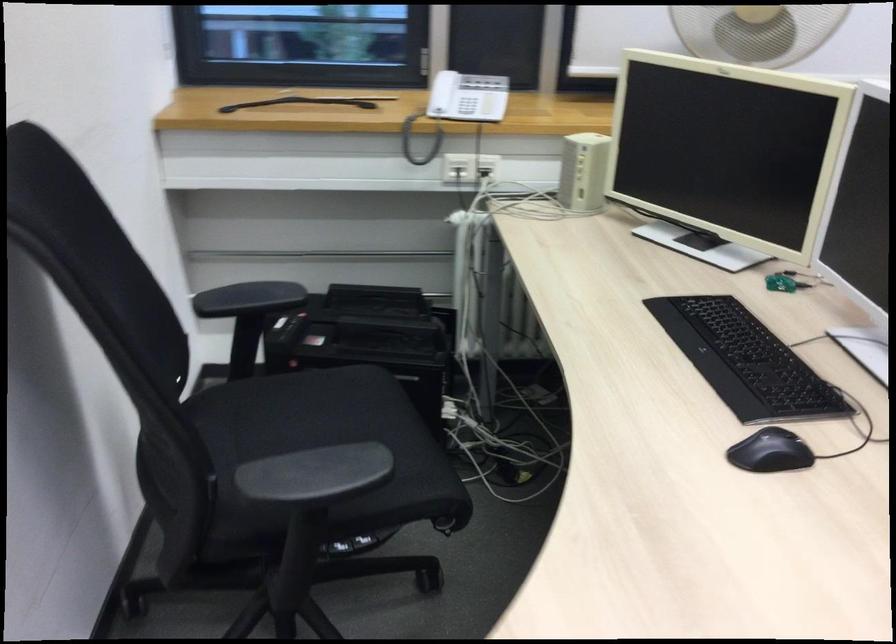
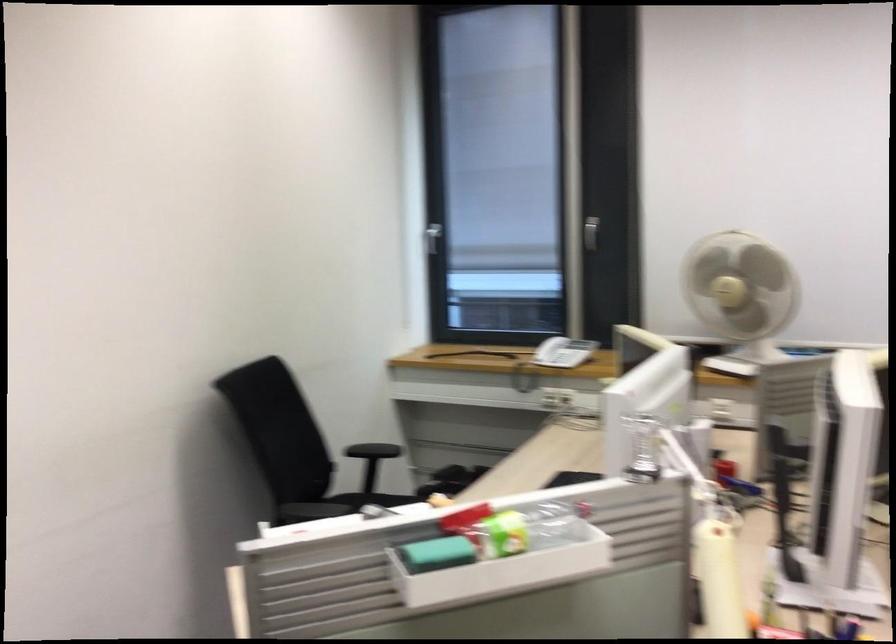
Question: I am providing you with two images of the same scene from different viewpoints. Which of the following objects are not visible in image2?

Choices:
 (A) black chair armrest
 (B) chair sitting surface
 (C) pink and white backpack
 (D) black computer mouse

Answer: (D)